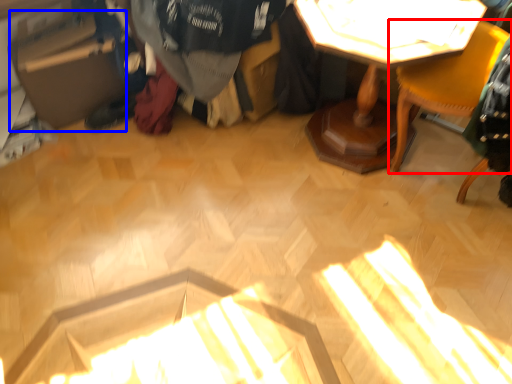
Question: Which object appears closest to the camera in this image, chair (highlighted by a red box) or cardboard box (highlighted by a blue box)?

Choices:
 (A) chair
 (B) cardboard box

Answer: (A)